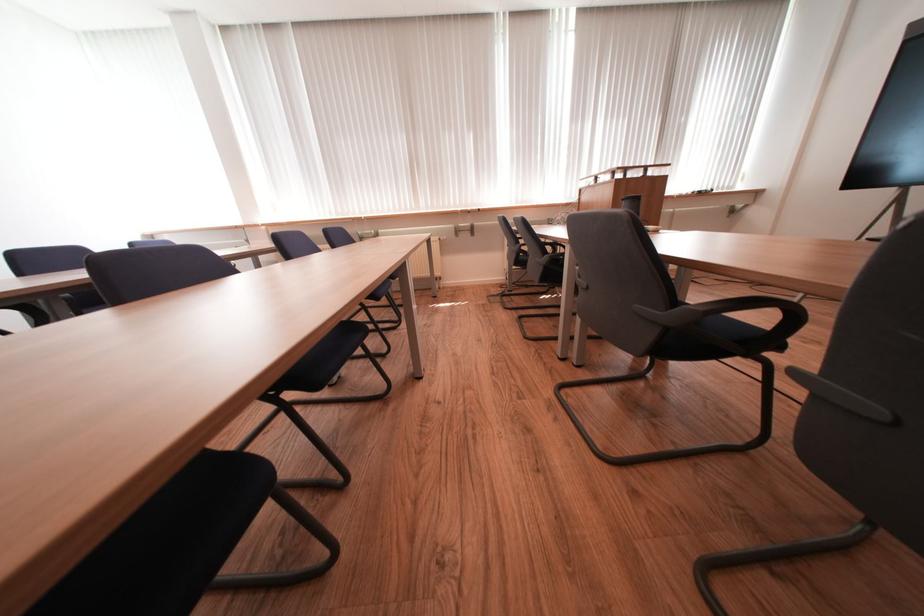
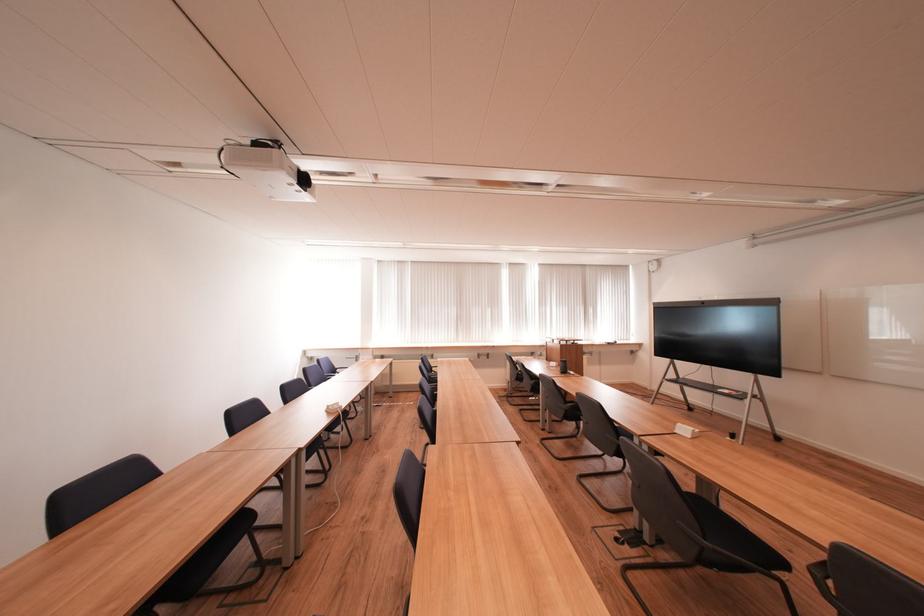
The images are taken continuously from a first-person perspective. In which direction are you moving?

The cameraman moved toward left, backward.